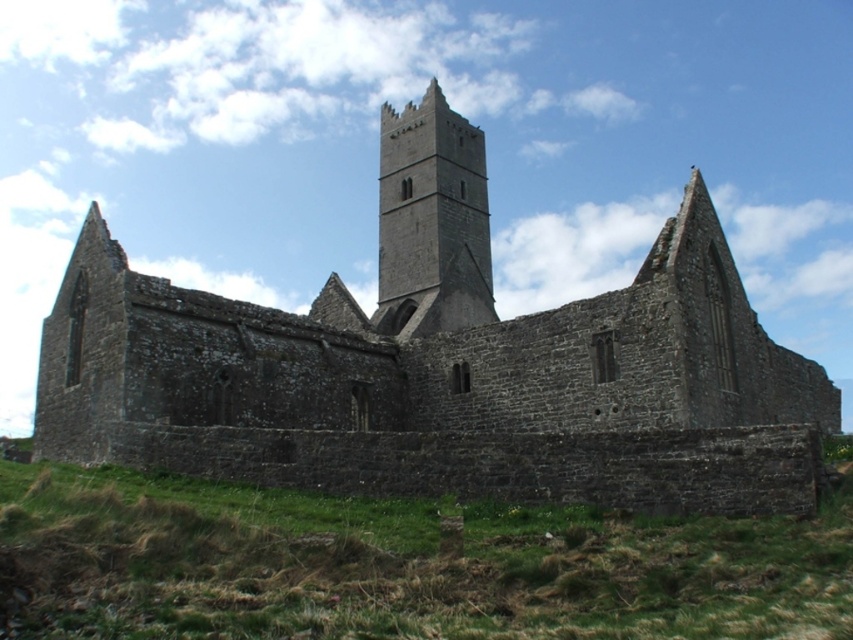
You are standing in the ruins of a medieval stone structure and want to move from the point closer to you to the point further away. Which path should you take between the two points, point (784, 356) and point (473, 516)?

You should move from point (784, 356) to point (473, 516) because point (784, 356) is closer to you and point (473, 516) is further away.

You are standing in the medieval ruins and want to cross from the green grass at lower center to the dark gray stone tower at center. Considering the height difference between them, will you need to climb upwards or downwards to reach the tower?

The green grass at lower center has a lesser height compared to dark gray stone tower at center, so you will need to climb upwards to reach the tower.

Looking at this image, you are standing at the point marked as point [444,365] in the image of the medieval ruins. What structure is located exactly at that point?

The gray stone church at center is located exactly at point [444,365].